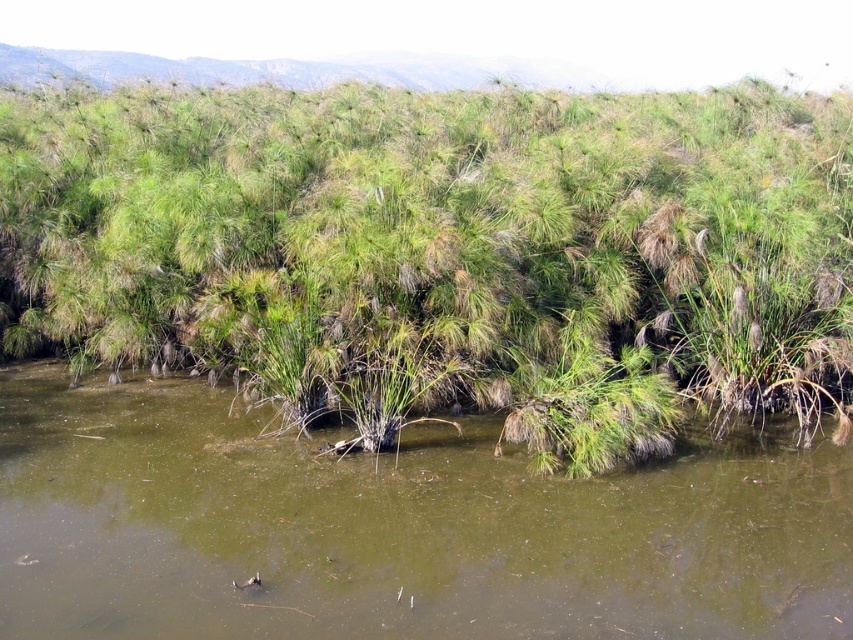
You are a wildlife photographer aiming to capture the green grassy plant at center and the green muddy water at center in your shot. Which object should you focus on first if you want to ensure both are in sharp focus?

The green grassy plant at center is wider than the green muddy water at center, so focusing on the green grassy plant at center first would help ensure both are in sharp focus since wider objects have a shallower depth of field.

You are standing on a wooden boardwalk that runs through the wetland. You notice a green grassy plant at center and a green muddy water at center. Which object is higher in elevation?

The green grassy plant at center is above the green muddy water at center, so it has a higher elevation.